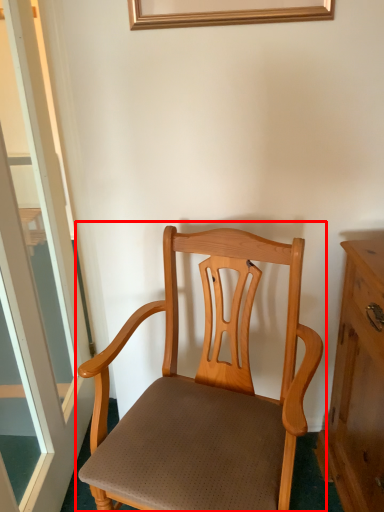
Question: Considering the relative positions of chair (annotated by the red box) and window in the image provided, where is chair (annotated by the red box) located with respect to the staircase?

Choices:
 (A) right
 (B) left

Answer: (A)